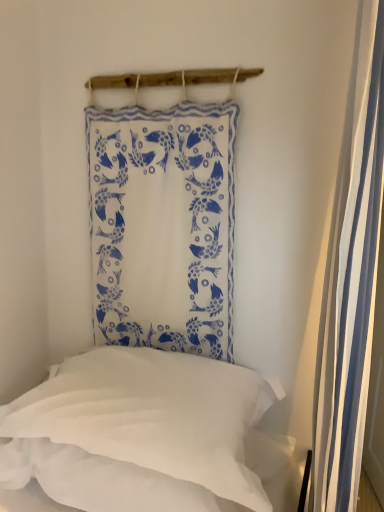
Question: From the image's perspective, would you say white striped fabric at right is positioned over white fabric with blue fish pattern at upper center?

Choices:
 (A) yes
 (B) no

Answer: (B)

Question: Does white striped fabric at right have a lesser height compared to white fabric with blue fish pattern at upper center?

Choices:
 (A) yes
 (B) no

Answer: (B)

Question: Is white striped fabric at right completely or partially outside of white fabric with blue fish pattern at upper center?

Choices:
 (A) yes
 (B) no

Answer: (A)

Question: Are white striped fabric at right and white fabric with blue fish pattern at upper center far apart?

Choices:
 (A) yes
 (B) no

Answer: (B)

Question: Does white striped fabric at right lie in front of white fabric with blue fish pattern at upper center?

Choices:
 (A) yes
 (B) no

Answer: (A)

Question: From the image's perspective, is white fabric with blue fish pattern at upper center positioned above or below white striped fabric at right?

Choices:
 (A) below
 (B) above

Answer: (B)

Question: Is point (213, 229) closer or farther from the camera than point (349, 228)?

Choices:
 (A) farther
 (B) closer

Answer: (A)

Question: Is white fabric with blue fish pattern at upper center wider or thinner than white striped fabric at right?

Choices:
 (A) thin
 (B) wide

Answer: (A)

Question: Relative to white striped fabric at right, is white fabric with blue fish pattern at upper center in front or behind?

Choices:
 (A) front
 (B) behind

Answer: (B)

Question: Is white fabric with blue fish pattern at upper center inside or outside of white soft pillow at lower left?

Choices:
 (A) inside
 (B) outside

Answer: (B)

Question: Looking at their shapes, would you say white fabric with blue fish pattern at upper center is wider or thinner than white soft pillow at lower left?

Choices:
 (A) thin
 (B) wide

Answer: (A)

Question: In terms of size, does white fabric with blue fish pattern at upper center appear bigger or smaller than white soft pillow at lower left?

Choices:
 (A) small
 (B) big

Answer: (A)

Question: From a real-world perspective, is white fabric with blue fish pattern at upper center positioned above or below white soft pillow at lower left?

Choices:
 (A) above
 (B) below

Answer: (A)

Question: Looking at their shapes, would you say white striped fabric at right is wider or thinner than white soft pillow at lower left?

Choices:
 (A) wide
 (B) thin

Answer: (B)

Question: In terms of height, does white striped fabric at right look taller or shorter compared to white soft pillow at lower left?

Choices:
 (A) tall
 (B) short

Answer: (A)